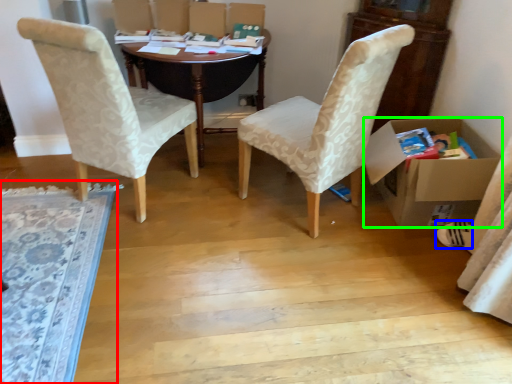
Question: Which object is positioned closest to mat (highlighted by a red box)? Select from footwear (highlighted by a blue box) and box (highlighted by a green box).

Choices:
 (A) footwear
 (B) box

Answer: (B)